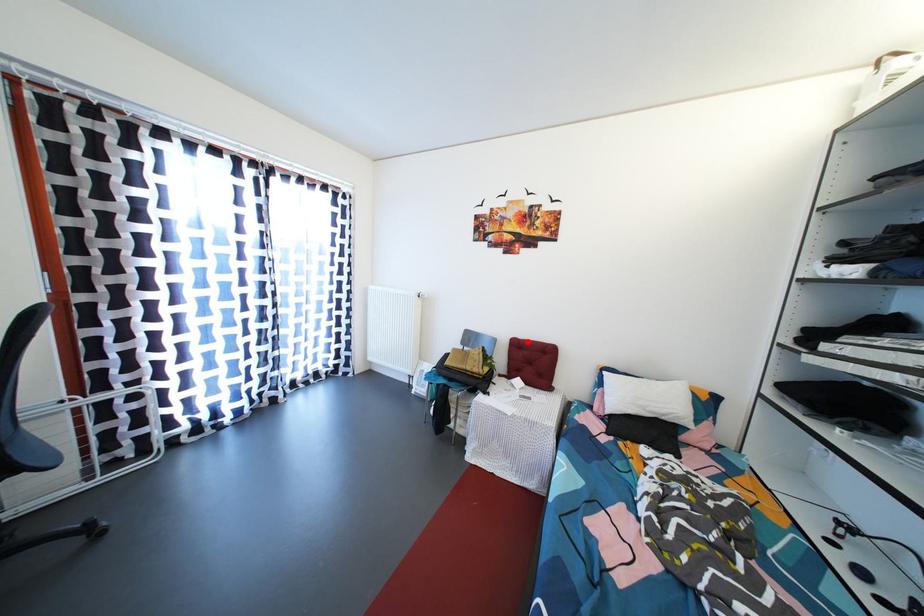
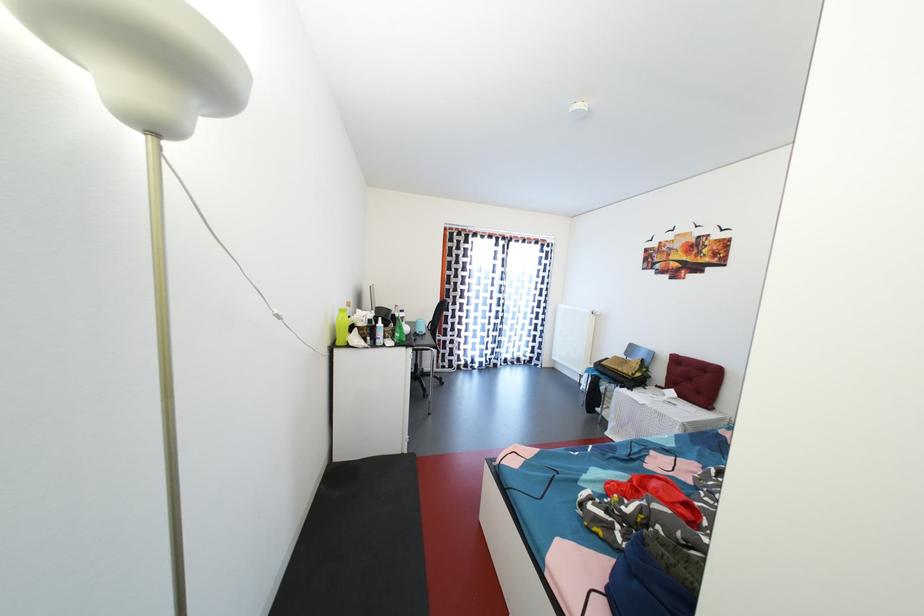
The point at the highlighted location is marked in the first image. Where is the corresponding point in the second image?

(688, 359)